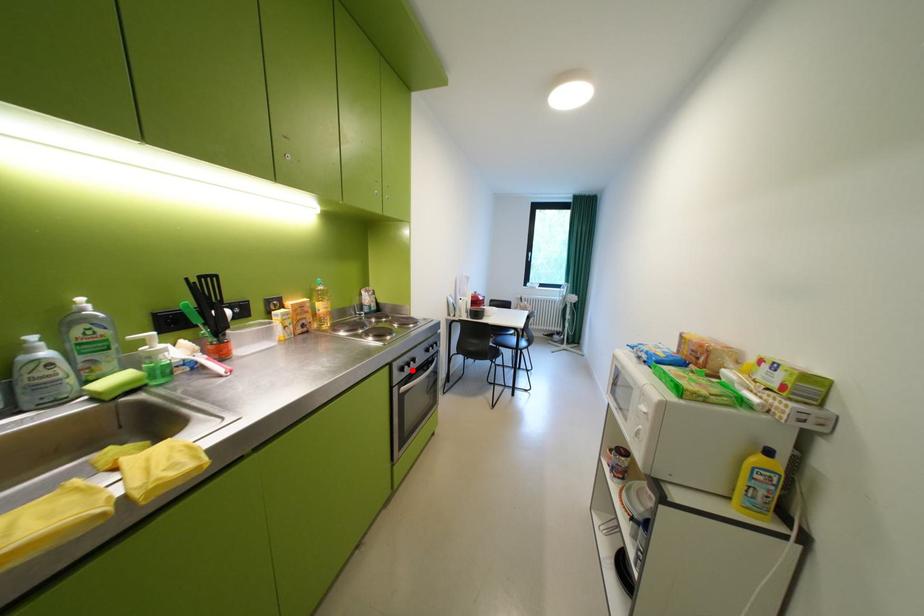
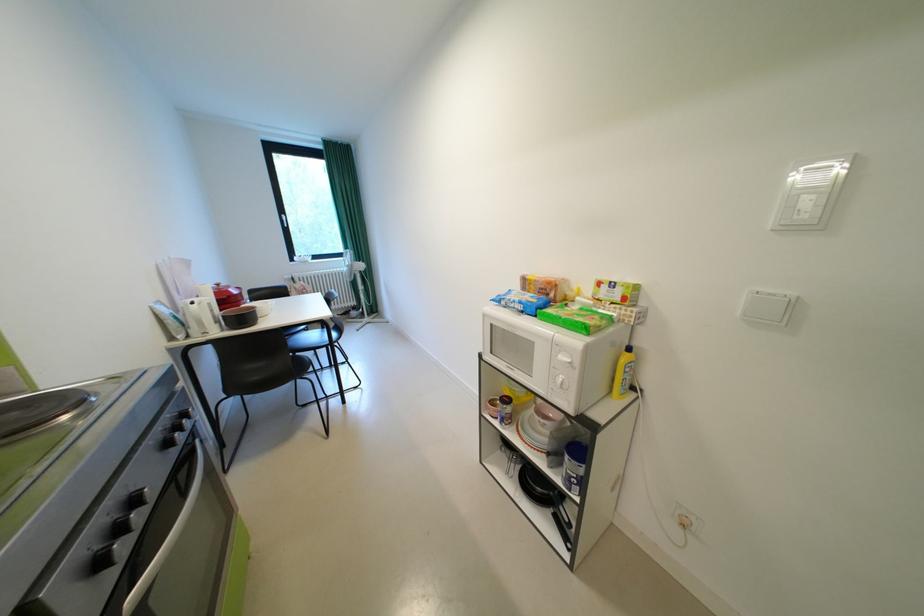
Question: I am providing you with two images of the same scene from different viewpoints. A red point is shown in image1. For the corresponding object point in image2, is it positioned nearer or farther from the camera?

Choices:
 (A) Nearer
 (B) Farther

Answer: (B)